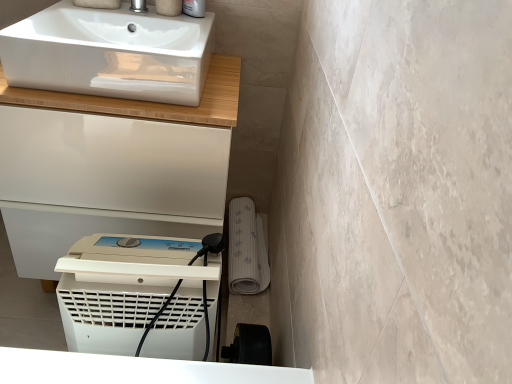
Question: From the image's perspective, would you say white plastic dehumidifier at lower center is shown under satin nickel faucet at upper center?

Choices:
 (A) no
 (B) yes

Answer: (B)

Question: Does white plastic dehumidifier at lower center have a larger size compared to satin nickel faucet at upper center?

Choices:
 (A) yes
 (B) no

Answer: (A)

Question: Does white plastic dehumidifier at lower center touch satin nickel faucet at upper center?

Choices:
 (A) no
 (B) yes

Answer: (A)

Question: Considering the relative sizes of white plastic dehumidifier at lower center and satin nickel faucet at upper center in the image provided, is white plastic dehumidifier at lower center wider than satin nickel faucet at upper center?

Choices:
 (A) no
 (B) yes

Answer: (B)

Question: Can you confirm if white plastic dehumidifier at lower center is taller than satin nickel faucet at upper center?

Choices:
 (A) no
 (B) yes

Answer: (B)

Question: From a real-world perspective, is white glossy cabinet at upper left above or below satin nickel faucet at upper center?

Choices:
 (A) below
 (B) above

Answer: (A)

Question: Based on their positions, is white glossy cabinet at upper left located to the left or right of satin nickel faucet at upper center?

Choices:
 (A) left
 (B) right

Answer: (A)

Question: From the image's perspective, is white glossy cabinet at upper left positioned above or below satin nickel faucet at upper center?

Choices:
 (A) above
 (B) below

Answer: (B)

Question: Is white glossy cabinet at upper left wider or thinner than satin nickel faucet at upper center?

Choices:
 (A) thin
 (B) wide

Answer: (B)

Question: Relative to white glossy cabinet at upper left, is white glossy sink at upper left in front or behind?

Choices:
 (A) behind
 (B) front

Answer: (B)

Question: Visually, is white glossy sink at upper left positioned to the left or to the right of white glossy cabinet at upper left?

Choices:
 (A) right
 (B) left

Answer: (A)

Question: Considering the positions of white glossy sink at upper left and white glossy cabinet at upper left in the image, is white glossy sink at upper left wider or thinner than white glossy cabinet at upper left?

Choices:
 (A) thin
 (B) wide

Answer: (A)

Question: Is white glossy sink at upper left bigger or smaller than white glossy cabinet at upper left?

Choices:
 (A) small
 (B) big

Answer: (A)

Question: Considering the positions of white plastic dehumidifier at lower center and white glossy cabinet at upper left in the image, is white plastic dehumidifier at lower center bigger or smaller than white glossy cabinet at upper left?

Choices:
 (A) small
 (B) big

Answer: (A)

Question: Considering the positions of point (105, 337) and point (173, 117), is point (105, 337) closer or farther from the camera than point (173, 117)?

Choices:
 (A) closer
 (B) farther

Answer: (A)